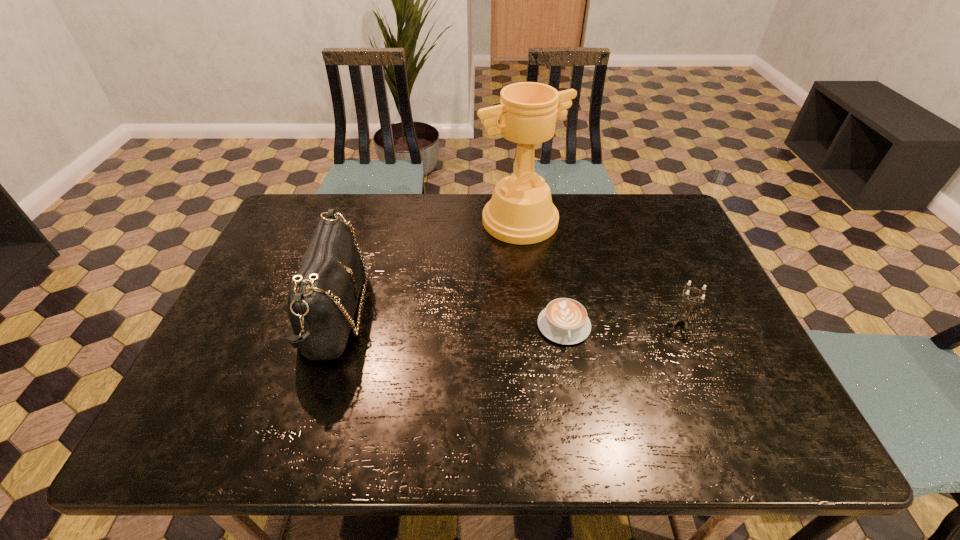
At what (x,y) coordinates should I click in order to perform the action: click on unoccupied position between the cappuccino and the handbag. Please return your answer as a coordinate pair (x, y). Looking at the image, I should click on (449, 320).

Locate an element on the screen. Image resolution: width=960 pixels, height=540 pixels. free space between the cappuccino and the tallest object is located at coordinates (542, 274).

Locate an element on the screen. The width and height of the screenshot is (960, 540). empty space that is in between the cappuccino and the candle holder is located at coordinates (622, 324).

Locate an element on the screen. empty space between the award and the handbag is located at coordinates (427, 268).

Identify the location of unoccupied area between the rightmost object and the third shortest object. (508, 318).

Where is `vacant space in between the shortest object and the third shortest object`? vacant space in between the shortest object and the third shortest object is located at coordinates (449, 320).

Image resolution: width=960 pixels, height=540 pixels. In order to click on vacant space that's between the cappuccino and the tallest object in this screenshot , I will do `click(542, 274)`.

In order to click on blank region between the handbag and the award in this screenshot , I will do `click(427, 268)`.

Identify which object is located as the second nearest to the leftmost object. Please provide its 2D coordinates. Your answer should be formatted as a tuple, i.e. [(x, y)], where the tuple contains the x and y coordinates of a point satisfying the conditions above.

[(564, 321)]

The image size is (960, 540). Identify the location of the third closest object to the shortest object. (322, 300).